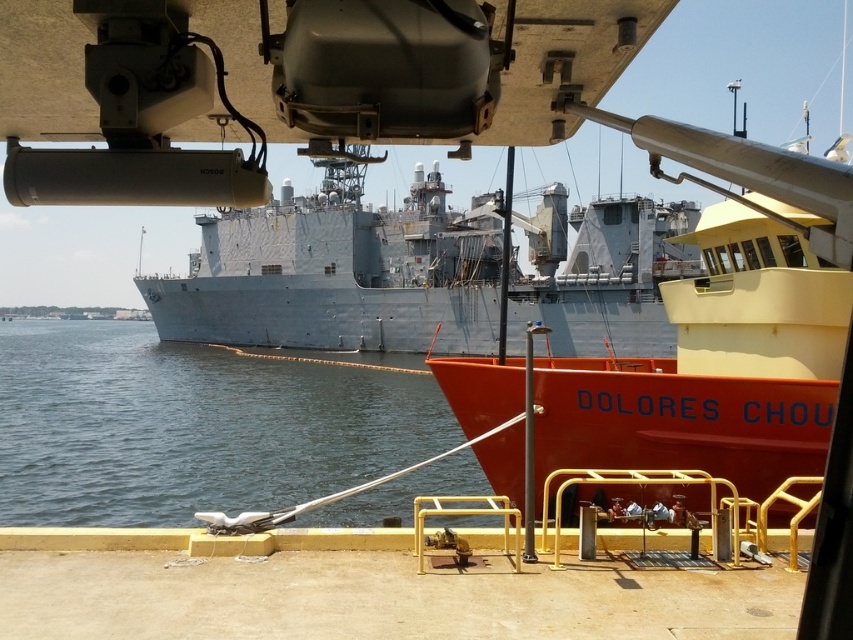
You are a harbor pilot planning to navigate a new ship into the port. The port authority requires all incoming vessels to dock at position coordinates between 0.5 and 0.8 on the x and y axes. Based on the scene, is the orange matte boat at center currently occupying the required docking coordinates?

The orange matte boat at center is located at coordinates point (722,330), which falls within the required docking coordinates between 0.5 and 0.8 on both axes. Therefore, the orange matte boat at center is occupying the required docking coordinates.

You are a dock worker who needs to secure both the orange matte boat at center and the gray matte ship at center. Which vessel should you attend to first if you want to start with the one that is closer to your current position?

You should attend to the orange matte boat at center first because it is closer to the viewer than the gray matte ship at center.

You are a sailor on the gray matte ship at center. You want to jump into the water. Can you jump directly into the clear water at center from your current position?

The clear water at center is positioned under the gray matte ship at center, so yes, you can jump directly into the clear water at center from your current position on the gray matte ship at center.